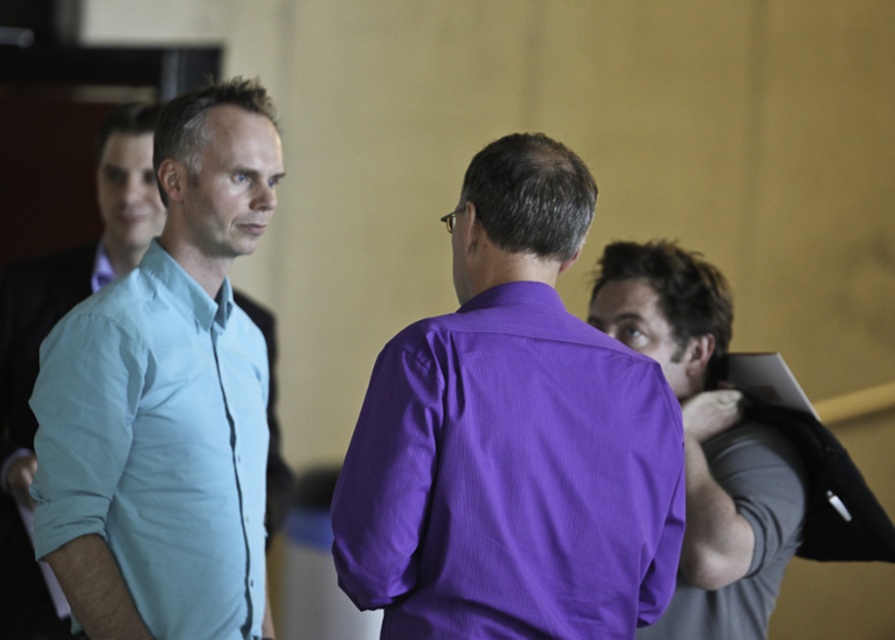
You are organizing a photo shoot and need to arrange the purple smooth shirt at center and the purple smooth shirt at right in a row. Based on the image, which of the two purple shirts should be placed on the left side of the row to maintain their original spatial relationship?

The purple smooth shirt at center should be placed on the left side of the row because in the original image, it is positioned to the left of the purple smooth shirt at right.

You are standing in the conference room and want to move from the point at coordinates point [395,442] to the point at coordinates point [243,403]. Can you walk directly between them without any obstruction?

Point [395,442] is in front of point [243,403], so there might be an obstruction between them. You cannot walk directly between them without any obstruction.